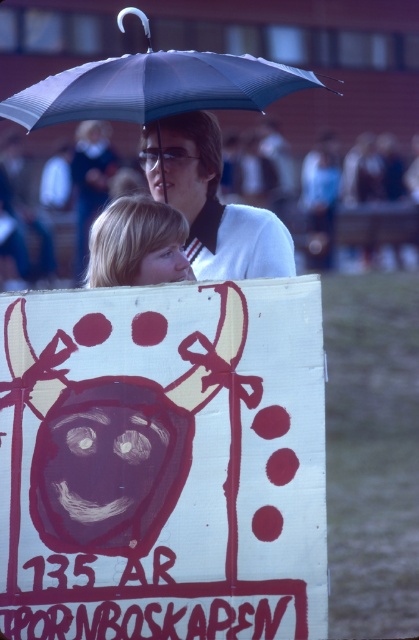
Question: Which point appears farthest from the camera in this image?

Choices:
 (A) (178, 72)
 (B) (220, 419)

Answer: (A)

Question: Which object is the farthest from the blonde hair at lower left?

Choices:
 (A) white paper sign at center
 (B) matte white shirt at upper center
 (C) matte black umbrella at upper center

Answer: (C)

Question: Considering the relative positions of blonde hair at lower left and matte white shirt at upper center in the image provided, where is blonde hair at lower left located with respect to matte white shirt at upper center?

Choices:
 (A) right
 (B) left

Answer: (A)

Question: Which point is farther to the camera?

Choices:
 (A) (95, 113)
 (B) (88, 193)
 (C) (106, 266)

Answer: (B)

Question: Is white paper sign at center to the right of matte black umbrella at upper center from the viewer's perspective?

Choices:
 (A) no
 (B) yes

Answer: (A)

Question: Is matte black umbrella at upper center wider than blonde hair at lower left?

Choices:
 (A) yes
 (B) no

Answer: (A)